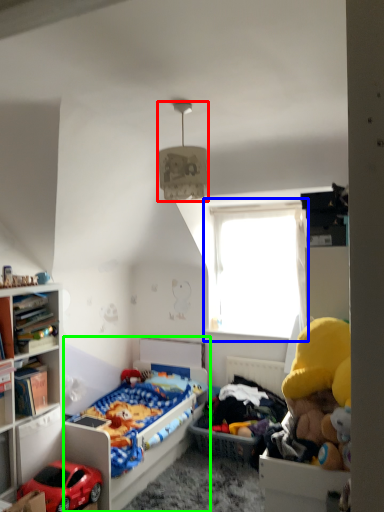
Question: Which object is the farthest from lamp (highlighted by a red box)? Choose among these: window (highlighted by a blue box) or bed (highlighted by a green box).

Choices:
 (A) window
 (B) bed

Answer: (A)